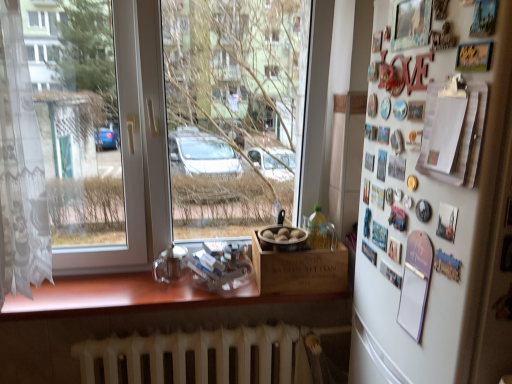
Question: Considering the positions of wooden box at center and wooden at lower center in the image, is wooden box at center wider or thinner than wooden at lower center?

Choices:
 (A) thin
 (B) wide

Answer: (A)

Question: From a real-world perspective, is wooden box at center above or below wooden at lower center?

Choices:
 (A) above
 (B) below

Answer: (A)

Question: Which object is the farthest from the wooden at lower center?

Choices:
 (A) wooden box at center
 (B) white matte refrigerator at right
 (C) transparent glass window at center
 (D) white metallic radiator at lower center

Answer: (B)

Question: Which object is the closest to the transparent glass window at center?

Choices:
 (A) white metallic radiator at lower center
 (B) wooden box at center
 (C) wooden at lower center
 (D) white matte refrigerator at right

Answer: (C)